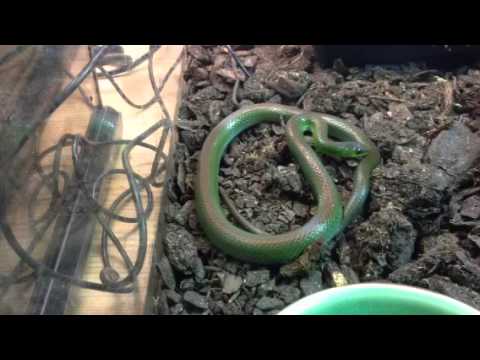
I want to click on black wire, so click(x=144, y=106), click(x=158, y=125), click(x=156, y=153), click(x=141, y=190).